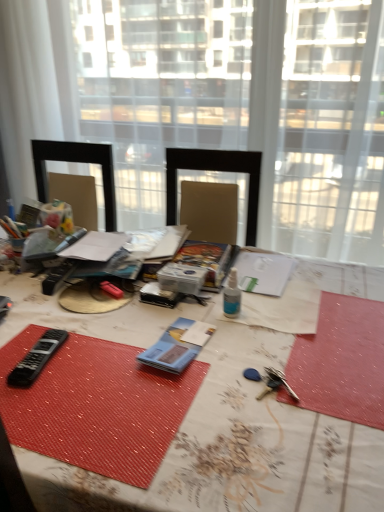
You are a GUI agent. You are given a task and a screenshot of the screen. Output one action in this format:
    pyautogui.click(x=<x>, y=<y>)
    Task: Click on the free space above white textured table at center (from a real-world perspective)
    The width and height of the screenshot is (384, 512).
    Given the screenshot: What is the action you would take?
    184,355